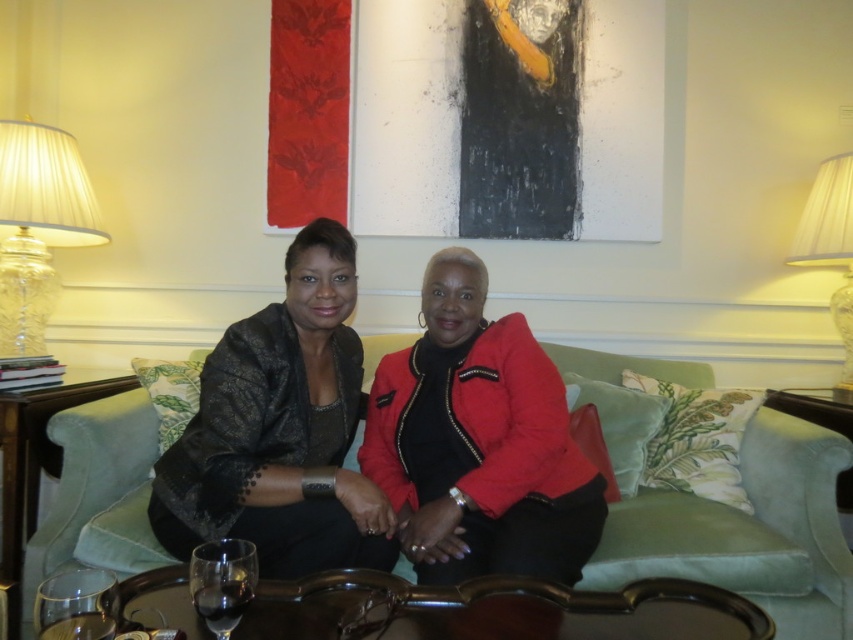
You are a delivery person standing in front of the green velvet couch at center. The package you need to deliver is 1.7 meters long. Can you place the package horizontally on the couch without moving the people sitting there?

The green velvet couch at center and viewer are 1.61 meters apart from each other. Since the package is 1.7 meters long, it would not fit horizontally on the couch as the distance between the viewer and the couch is shorter than the package length.

You are trying to decide whether to place a new rectangular photo frame between the clear glass lampshade at left and the wooden table at lower left. The frame is 10 cm wide. Can you fit it there?

The clear glass lampshade at left is thinner than the wooden table at lower left, so the space between them is sufficient to fit a 10 cm wide photo frame.

In the scene shown: You are a guest in the living room and want to place a small vase on the wooden table at lower left. However, there is a clear glass lampshade at left in the way. Can you move the vase to the table without moving the lampshade?

The wooden table at lower left is behind the clear glass lampshade at left, so you can move the vase to the table by going around the lampshade since the table is positioned behind it.